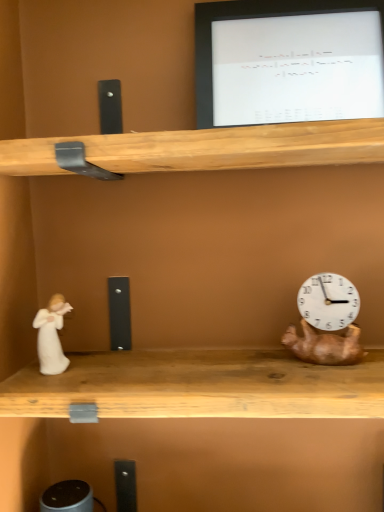
Question: Is white porcelain figurine at left taller than white glossy monitor at upper center?

Choices:
 (A) no
 (B) yes

Answer: (A)

Question: Would you say white porcelain figurine at left is a long distance from white glossy monitor at upper center?

Choices:
 (A) yes
 (B) no

Answer: (B)

Question: Does white porcelain figurine at left turn towards white glossy monitor at upper center?

Choices:
 (A) no
 (B) yes

Answer: (A)

Question: Considering the relative positions of white porcelain figurine at left and white glossy monitor at upper center in the image provided, is white porcelain figurine at left to the right of white glossy monitor at upper center from the viewer's perspective?

Choices:
 (A) yes
 (B) no

Answer: (B)

Question: Is white porcelain figurine at left looking in the opposite direction of white glossy monitor at upper center?

Choices:
 (A) no
 (B) yes

Answer: (A)

Question: Is white glossy monitor at upper center situated inside white porcelain figurine at left or outside?

Choices:
 (A) outside
 (B) inside

Answer: (A)

Question: Based on their sizes in the image, would you say white glossy monitor at upper center is bigger or smaller than white porcelain figurine at left?

Choices:
 (A) big
 (B) small

Answer: (A)

Question: From the image's perspective, is white glossy monitor at upper center above or below white porcelain figurine at left?

Choices:
 (A) below
 (B) above

Answer: (B)

Question: Is white glossy monitor at upper center wider or thinner than white porcelain figurine at left?

Choices:
 (A) wide
 (B) thin

Answer: (A)

Question: Which is correct: white porcelain figurine at left is inside white glossy monitor at upper center, or outside of it?

Choices:
 (A) outside
 (B) inside

Answer: (A)

Question: Is white porcelain figurine at left bigger or smaller than white glossy monitor at upper center?

Choices:
 (A) big
 (B) small

Answer: (B)

Question: Relative to white glossy monitor at upper center, is white porcelain figurine at left in front or behind?

Choices:
 (A) front
 (B) behind

Answer: (B)

Question: Considering the positions of white porcelain figurine at left and white glossy monitor at upper center in the image, is white porcelain figurine at left wider or thinner than white glossy monitor at upper center?

Choices:
 (A) thin
 (B) wide

Answer: (A)

Question: Looking at the image, does white glossy monitor at upper center seem bigger or smaller compared to copper metallic clock at right?

Choices:
 (A) small
 (B) big

Answer: (B)

Question: Is point (292, 92) positioned closer to the camera than point (309, 331)?

Choices:
 (A) farther
 (B) closer

Answer: (B)